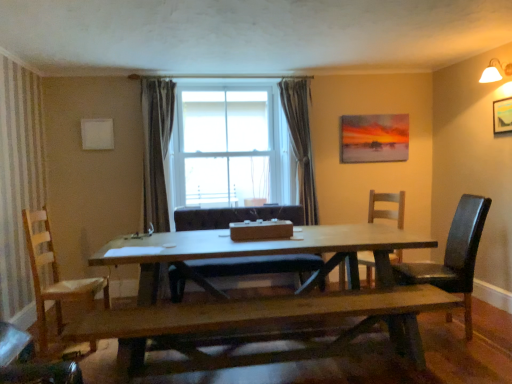
The height and width of the screenshot is (384, 512). I want to click on vacant space underneath white fabric lampshade at upper right (from a real-world perspective), so click(489, 308).